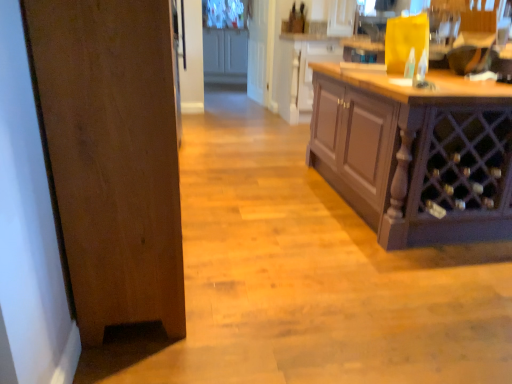
Question: Are wooden door at left and brown wood cabinet at right, which ranks as the first cabinetry in bottom-to-top order, far apart?

Choices:
 (A) yes
 (B) no

Answer: (A)

Question: Are wooden door at left and brown wood cabinet at right, the third cabinetry in the left-to-right sequence, making contact?

Choices:
 (A) yes
 (B) no

Answer: (B)

Question: Does wooden door at left appear on the left side of brown wood cabinet at right, which ranks as the third cabinetry in back-to-front order?

Choices:
 (A) no
 (B) yes

Answer: (B)

Question: From the image's perspective, is wooden door at left located beneath brown wood cabinet at right, the third cabinetry in the left-to-right sequence?

Choices:
 (A) no
 (B) yes

Answer: (B)

Question: From a real-world perspective, is wooden door at left positioned over brown wood cabinet at right, which ranks as the third cabinetry in back-to-front order, based on gravity?

Choices:
 (A) no
 (B) yes

Answer: (B)

Question: Is wooden door at left taller than brown wood cabinet at right, which ranks as the third cabinetry in back-to-front order?

Choices:
 (A) no
 (B) yes

Answer: (B)

Question: From a real-world perspective, is matte gray cabinets at upper center, which is the third cabinetry in bottom-to-top order, physically above white glossy door at upper center?

Choices:
 (A) no
 (B) yes

Answer: (A)

Question: Can you confirm if matte gray cabinets at upper center, the 3th cabinetry when ordered from right to left, is positioned to the right of white glossy door at upper center?

Choices:
 (A) no
 (B) yes

Answer: (A)

Question: Is matte gray cabinets at upper center, which is the third cabinetry in bottom-to-top order, thinner than white glossy door at upper center?

Choices:
 (A) yes
 (B) no

Answer: (B)

Question: Does matte gray cabinets at upper center, the 3th cabinetry when ordered from right to left, have a greater height compared to white glossy door at upper center?

Choices:
 (A) yes
 (B) no

Answer: (B)

Question: Is matte gray cabinets at upper center, which is the 1th cabinetry in top-to-bottom order, aimed at white glossy door at upper center?

Choices:
 (A) no
 (B) yes

Answer: (B)

Question: Is the depth of matte gray cabinets at upper center, which is the 3th cabinetry from front to back, less than that of white glossy door at upper center?

Choices:
 (A) yes
 (B) no

Answer: (B)

Question: From the image's perspective, does matte wood cabinet at center, the second cabinetry viewed from the top, appear higher than white glossy door at upper center?

Choices:
 (A) yes
 (B) no

Answer: (B)